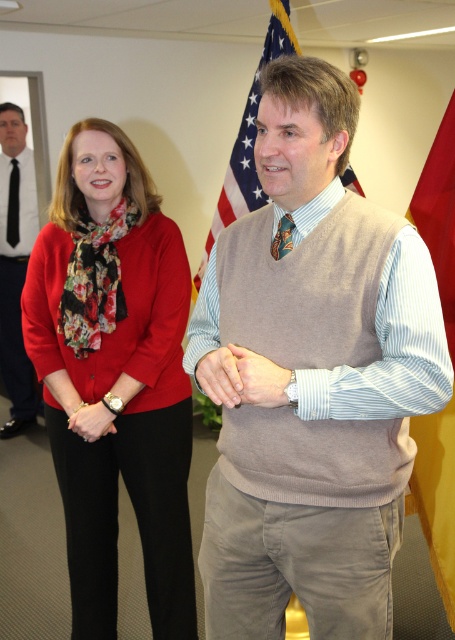
Question: Estimate the real-world distances between objects in this image. Which object is farther from the matte black tie at left?

Choices:
 (A) light brown sweater vest at center
 (B) shiny blue tie at center

Answer: (B)

Question: Estimate the real-world distances between objects in this image. Which object is farther from the american flag at center?

Choices:
 (A) matte black watch at lower left
 (B) matte beige sweater at center
 (C) matte red sweater at left

Answer: (B)

Question: Does red fabric flag at right appear over black silk tie at center?

Choices:
 (A) no
 (B) yes

Answer: (A)

Question: Which object appears closest to the camera in this image?

Choices:
 (A) matte black tie at left
 (B) matte beige sweater at center

Answer: (B)

Question: Does light brown sweater vest at center appear under matte black watch at lower left?

Choices:
 (A) no
 (B) yes

Answer: (A)

Question: Can you confirm if matte black watch at lower left is thinner than black silk tie at center?

Choices:
 (A) no
 (B) yes

Answer: (A)